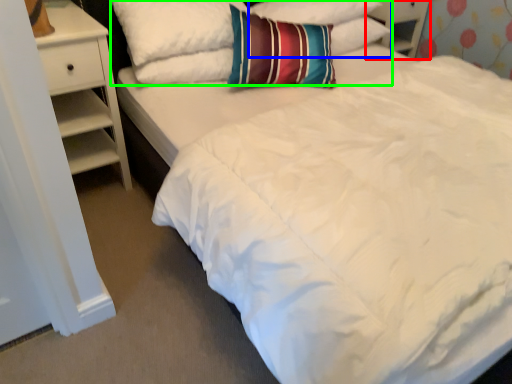
Question: Considering the real-world distances, which object is farthest from dresser (highlighted by a red box)? pillow (highlighted by a blue box) or pillow (highlighted by a green box)?

Choices:
 (A) pillow
 (B) pillow

Answer: (B)